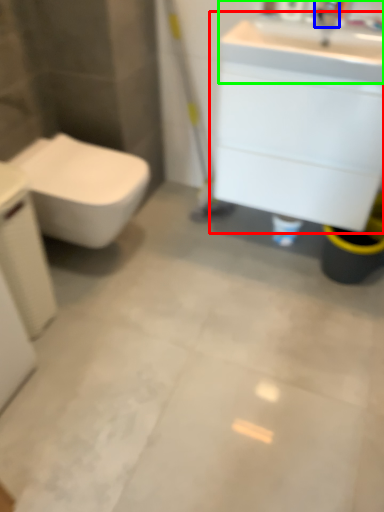
Question: Which object is positioned closest to bathroom cabinet (highlighted by a red box)? Select from faucet (highlighted by a blue box) and sink (highlighted by a green box).

Choices:
 (A) faucet
 (B) sink

Answer: (B)